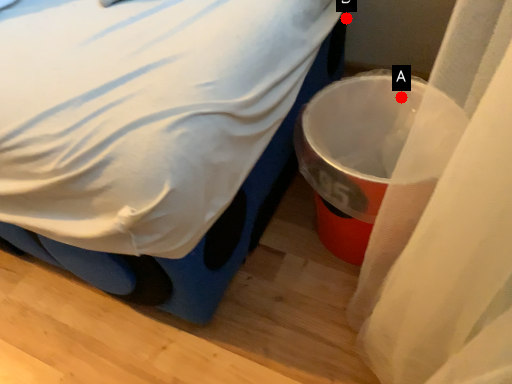
Question: Two points are circled on the image, labeled by A and B beside each circle. Which point appears farthest from the camera in this image?

Choices:
 (A) A is further
 (B) B is further

Answer: (B)